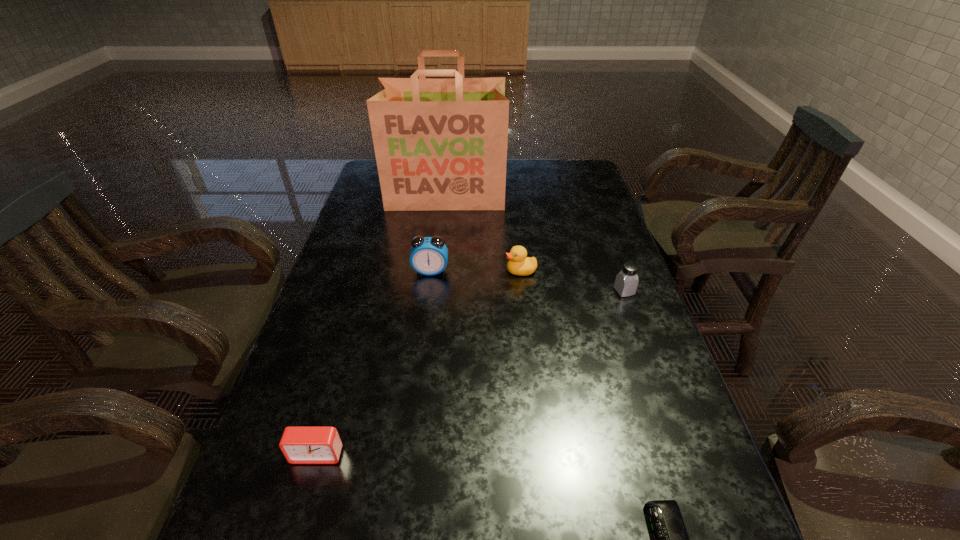
Identify which object is the second nearest to the rightmost object. Please provide its 2D coordinates. Your answer should be formatted as a tuple, i.e. [(x, y)], where the tuple contains the x and y coordinates of a point satisfying the conditions above.

[(429, 255)]

The height and width of the screenshot is (540, 960). In order to click on object that is the fifth closest to the duckling in this screenshot , I will do `click(669, 539)`.

Identify which alarm clock is the second closest to the rightmost alarm clock. Please provide its 2D coordinates. Your answer should be formatted as a tuple, i.e. [(x, y)], where the tuple contains the x and y coordinates of a point satisfying the conditions above.

[(429, 255)]

Identify which alarm clock is the closest to the second tallest alarm clock. Please provide its 2D coordinates. Your answer should be formatted as a tuple, i.e. [(x, y)], where the tuple contains the x and y coordinates of a point satisfying the conditions above.

[(429, 255)]

Locate an element on the screen. The width and height of the screenshot is (960, 540). blank space that satisfies the following two spatial constraints: 1. on the face of the duckling; 2. on the front-facing side of the second nearest object is located at coordinates (540, 454).

In order to click on vacant area in the image that satisfies the following two spatial constraints: 1. on the face of the farthest alarm clock; 2. on the left side of the third nearest object in this screenshot , I will do `click(428, 291)`.

Find the location of a particular element. vacant region that satisfies the following two spatial constraints: 1. on the face of the duckling; 2. on the front-facing side of the second shortest alarm clock is located at coordinates (540, 454).

Find the location of `free space that satisfies the following two spatial constraints: 1. on the face of the duckling; 2. on the back side of the fourth farthest object`. free space that satisfies the following two spatial constraints: 1. on the face of the duckling; 2. on the back side of the fourth farthest object is located at coordinates (523, 291).

Identify the location of vacant point that satisfies the following two spatial constraints: 1. on the face of the saltshaker; 2. on the right side of the tallest alarm clock. This screenshot has height=540, width=960. (428, 291).